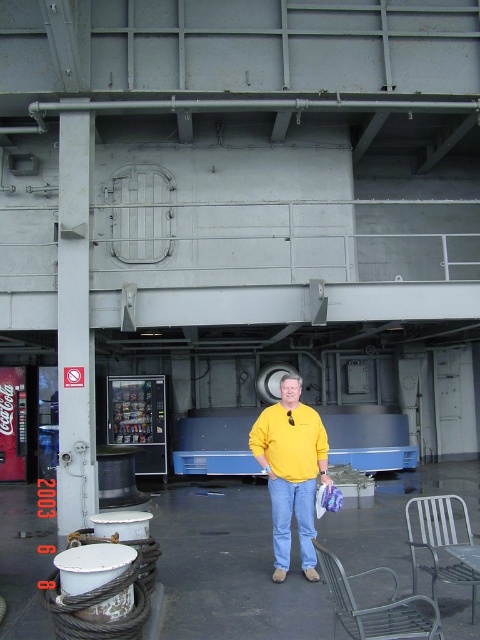
Question: Which point is closer to the camera?

Choices:
 (A) (284, 547)
 (B) (417, 600)
 (C) (311, 525)
 (D) (418, 544)

Answer: (B)

Question: Based on their relative distances, which object is nearer to the gray metallic pole at left?

Choices:
 (A) yellow matte sweater at center
 (B) blue denim jeans at center

Answer: (A)

Question: Is yellow matte sweater at center above metallic silver chair at lower right?

Choices:
 (A) yes
 (B) no

Answer: (A)

Question: Can you confirm if gray metallic pole at left is positioned to the right of metallic wire mesh bench at lower right?

Choices:
 (A) no
 (B) yes

Answer: (A)

Question: Which of the following is the closest to the observer?

Choices:
 (A) metallic silver chair at lower right
 (B) yellow matte sweater at center
 (C) metallic wire mesh bench at lower right

Answer: (C)

Question: Can you confirm if yellow matte sweater at center is smaller than metallic silver chair at lower right?

Choices:
 (A) yes
 (B) no

Answer: (B)